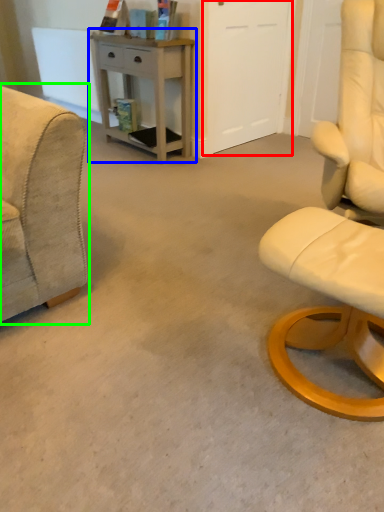
Question: Based on their relative distances, which object is nearer to glass door (highlighted by a red box)? Choose from desk (highlighted by a blue box) and chair (highlighted by a green box).

Choices:
 (A) desk
 (B) chair

Answer: (A)